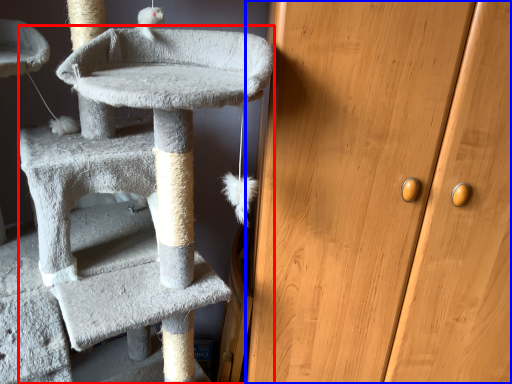
Question: Among these objects, which one is farthest to the camera, cat furniture (highlighted by a red box) or door (highlighted by a blue box)?

Choices:
 (A) cat furniture
 (B) door

Answer: (B)